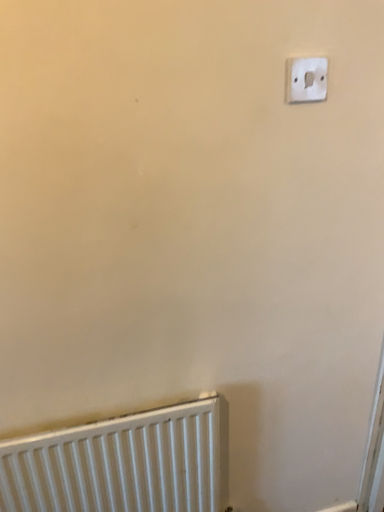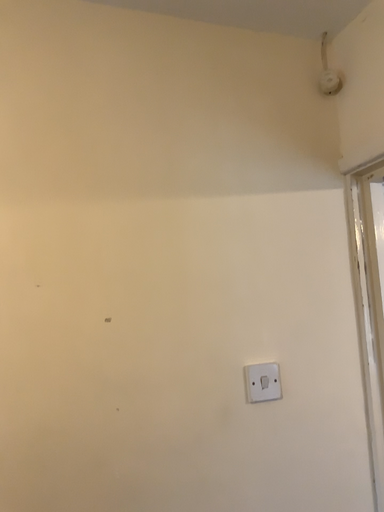
Question: How did the camera likely rotate when shooting the video?

Choices:
 (A) rotated downward
 (B) rotated upward

Answer: (B)